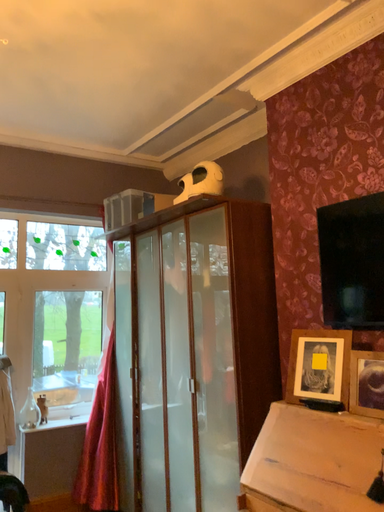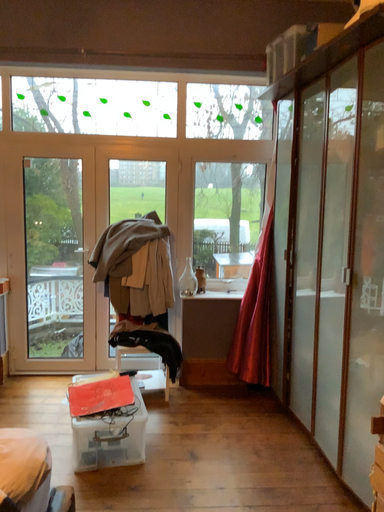
Question: Which way did the camera rotate in the video?

Choices:
 (A) rotated upward
 (B) rotated downward

Answer: (B)